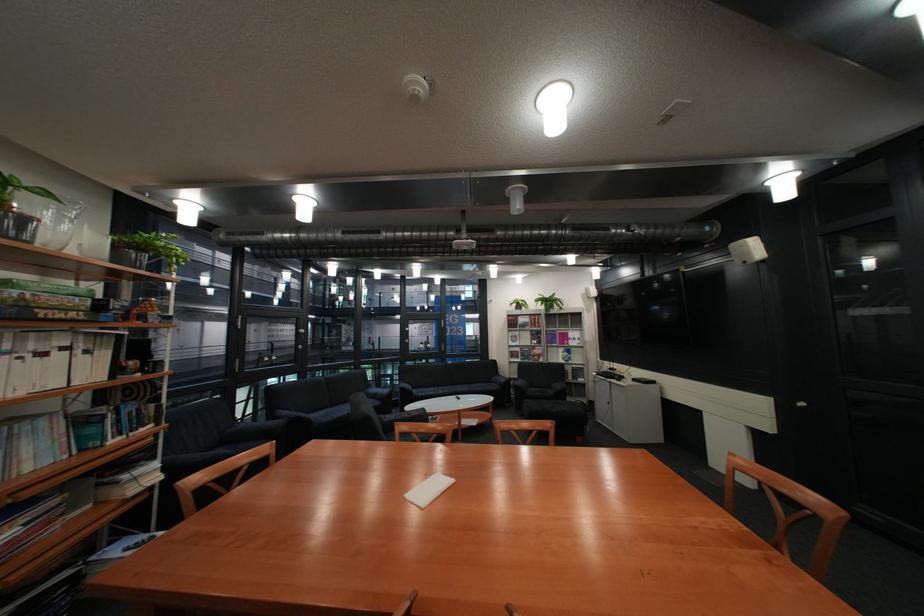
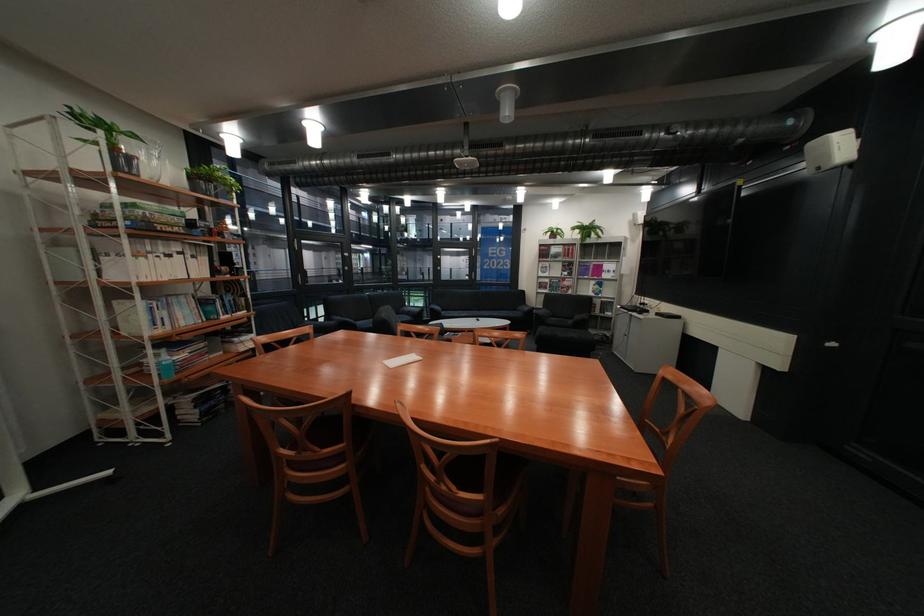
Locate, in the second image, the point that corresponds to (420,496) in the first image.

(398, 361)